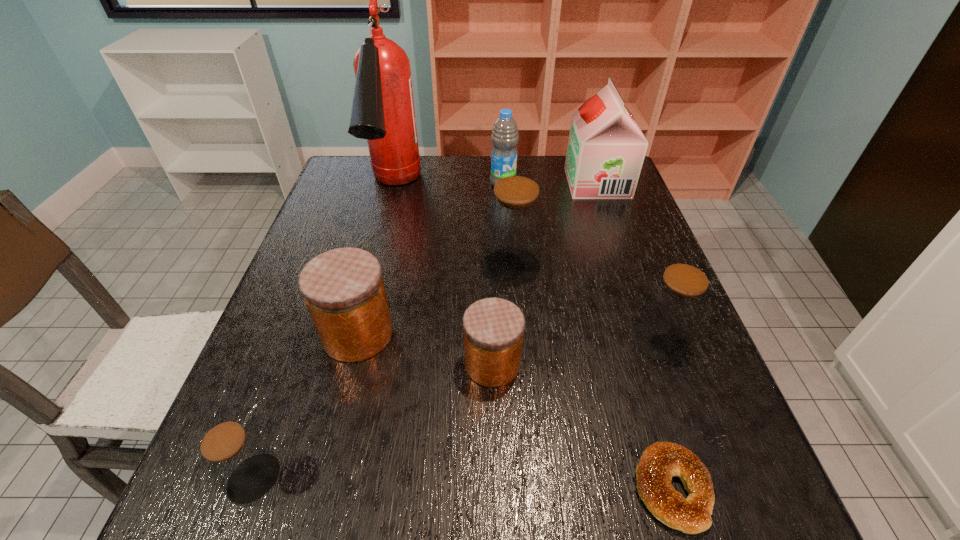
Identify which object is the sixth nearest to the left orange jar. Please provide its 2D coordinates. Your answer should be formatted as a tuple, i.e. [(x, y)], where the tuple contains the x and y coordinates of a point satisfying the conditions above.

[(675, 304)]

The width and height of the screenshot is (960, 540). Find the location of `object that is the fifth nearest to the nearest brown jar`. object that is the fifth nearest to the nearest brown jar is located at coordinates (383, 112).

The width and height of the screenshot is (960, 540). I want to click on the second closest jar to the bigger orange jar, so click(x=236, y=458).

Find the location of `jar that is the closest to the bigger orange jar`. jar that is the closest to the bigger orange jar is located at coordinates (493, 328).

Where is `brown jar that is the closest one to the fire extinguisher`? brown jar that is the closest one to the fire extinguisher is located at coordinates (514, 220).

Find the location of a particular element. The height and width of the screenshot is (540, 960). brown jar that is the second closest to the tallest object is located at coordinates (675, 304).

Where is `free location that satisfies the following two spatial constraints: 1. on the front side of the bagel; 2. on the left side of the bigger orange jar`? free location that satisfies the following two spatial constraints: 1. on the front side of the bagel; 2. on the left side of the bigger orange jar is located at coordinates (319, 489).

The height and width of the screenshot is (540, 960). In order to click on free spot that satisfies the following two spatial constraints: 1. with the cap open on the eighth shortest object; 2. at the nozzle end of the fire extinguisher in this screenshot , I will do pos(600,192).